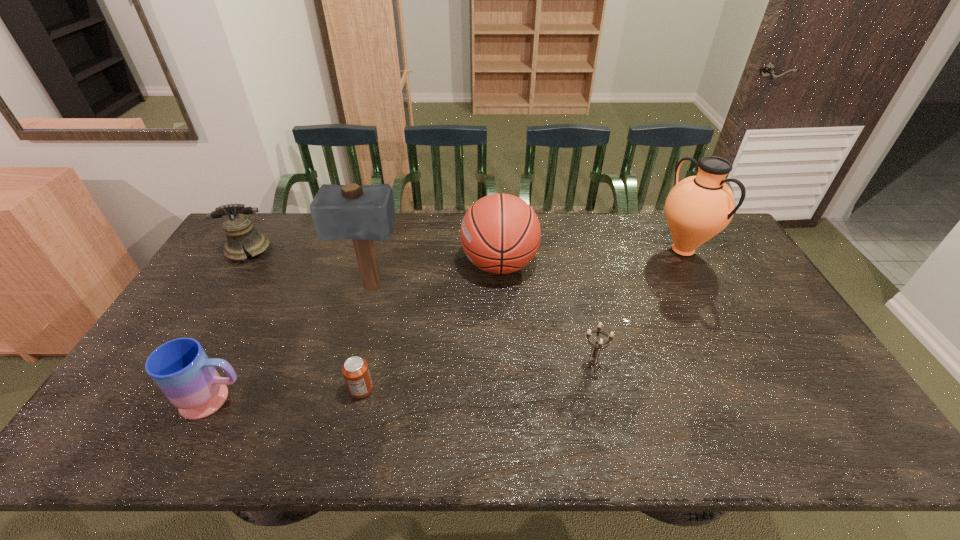
Where is `mallet`? The width and height of the screenshot is (960, 540). mallet is located at coordinates (364, 213).

Image resolution: width=960 pixels, height=540 pixels. What are the coordinates of `pitcher` in the screenshot? It's located at (697, 208).

Locate an element on the screen. The height and width of the screenshot is (540, 960). the fifth object from left to right is located at coordinates (500, 233).

At what (x,y) coordinates should I click in order to perform the action: click on the fifth shortest object. Please return your answer as a coordinate pair (x, y). The height and width of the screenshot is (540, 960). Looking at the image, I should click on (500, 233).

I want to click on bell, so click(x=238, y=228).

This screenshot has height=540, width=960. What are the coordinates of `mug` in the screenshot? It's located at click(182, 370).

Identify the location of candle holder. The image size is (960, 540). 593,361.

Identify the location of the sixth tallest object. (593, 361).

You are a GUI agent. You are given a task and a screenshot of the screen. Output one action in this format:
    pyautogui.click(x=<x>, y=<y>)
    Task: Click on the can
    The width and height of the screenshot is (960, 540).
    Given the screenshot: What is the action you would take?
    pyautogui.click(x=355, y=370)

You are a GUI agent. You are given a task and a screenshot of the screen. Output one action in this format:
    pyautogui.click(x=<x>, y=<y>)
    Task: Click on the free space located 0.390m on the right of the mallet
    This screenshot has width=960, height=540.
    Given the screenshot: What is the action you would take?
    pyautogui.click(x=528, y=288)